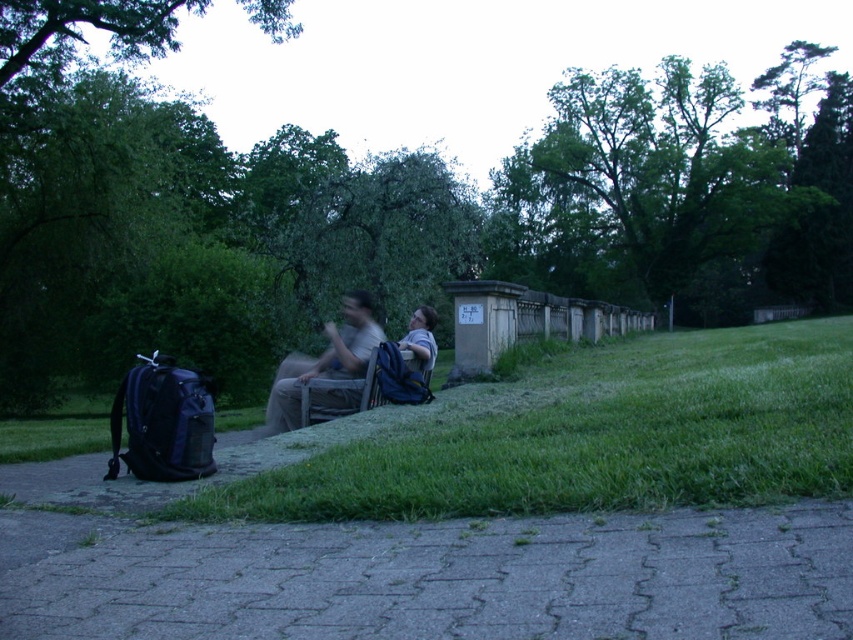
Can you confirm if green grass at lower center is taller than matte gray shirt at center?

No.

Is green grass at lower center to the left of matte gray shirt at center from the viewer's perspective?

In fact, green grass at lower center is to the right of matte gray shirt at center.

Is point (500, 442) less distant than point (308, 372)?

Yes.

Locate an element on the screen. The image size is (853, 640). green grass at lower center is located at coordinates (595, 436).

Does gray concrete pavement at lower center have a greater width compared to matte gray shirt at center?

Indeed, gray concrete pavement at lower center has a greater width compared to matte gray shirt at center.

Is gray concrete pavement at lower center taller than matte gray shirt at center?

No.

Is point (318, 611) closer to camera compared to point (283, 429)?

Yes, it is.

Locate an element on the screen. gray concrete pavement at lower center is located at coordinates (453, 579).

Based on the photo, which is above, gray concrete pavement at lower center or green grass at lower center?

green grass at lower center is above.

Between point (332, 632) and point (671, 374), which one is positioned in front?

Point (332, 632) is more forward.

Between point (155, 540) and point (769, 401), which one is positioned in front?

Point (155, 540)

Identify the location of gray concrete pavement at lower center. The width and height of the screenshot is (853, 640). (453, 579).